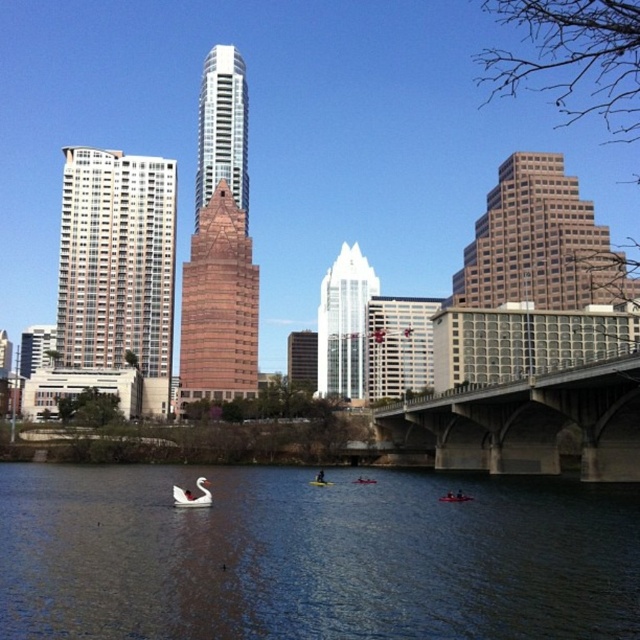
You are an event planner organizing a river tour and need to choose between the orange plastic kayak at lower center and the red plastic kayak at center. Based on their size, which kayak would be better suited for a group of four adults?

The red plastic kayak at center is better suited for a group of four adults since it occupies more space than the orange plastic kayak at lower center, providing enough room for the group.

Looking at this image, you are a tourist standing on the riverbank and want to take a photo of the white matte swan at lower center and the concrete bridge at center. Which object should you frame first in your camera viewfinder to ensure both are in the shot?

You should frame the white matte swan at lower center first because the concrete bridge at center is positioned to its right side, so starting with the swan ensures the bridge will be included in the shot.

You are standing at the center of the concrete bridge with arches. You want to reach the orange plastic kayak at lower center. Which direction should you go to reach it?

The orange plastic kayak at lower center is located at point (454, 497), so you should go towards the lower center direction to reach it.